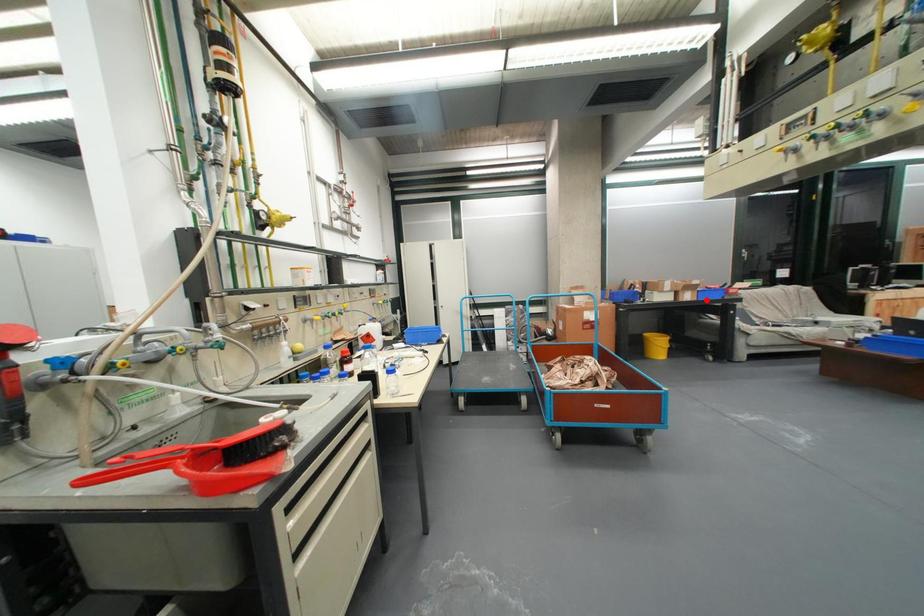
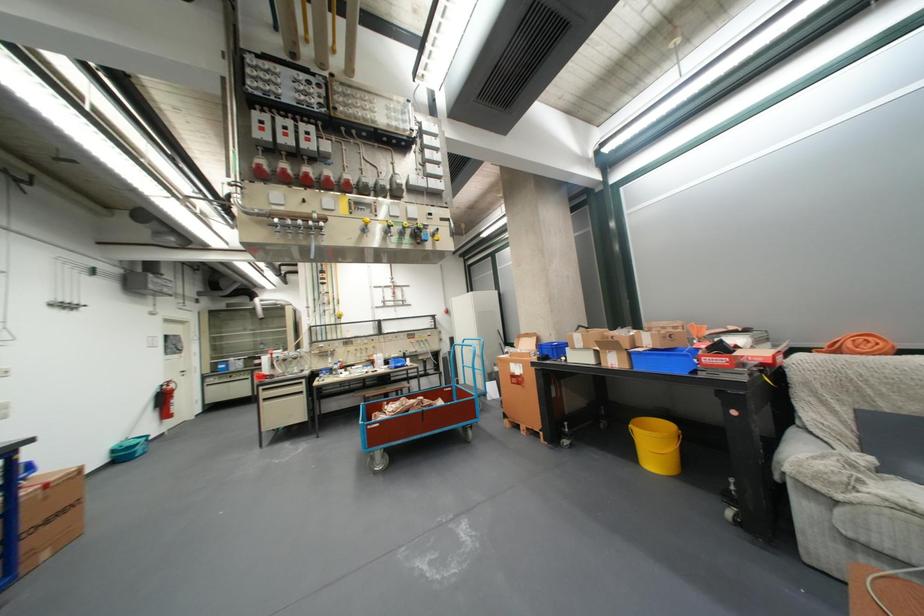
Find the pixel in the second image that matches the highlighted location in the first image.

(638, 368)